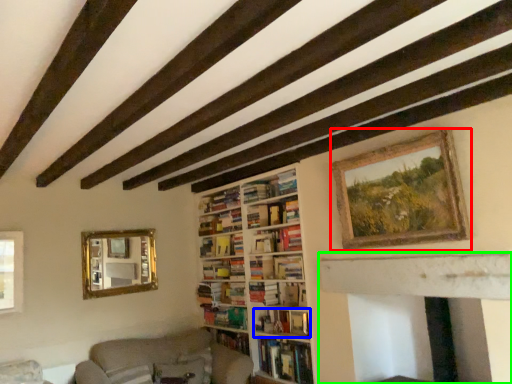
Question: Which object is positioned farthest from picture frame (highlighted by a red box)? Select from book (highlighted by a blue box) and fireplace (highlighted by a green box).

Choices:
 (A) book
 (B) fireplace

Answer: (A)